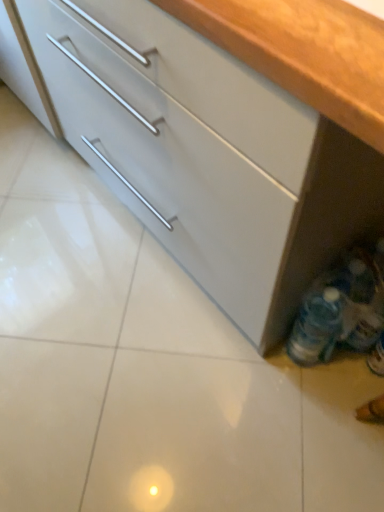
This screenshot has width=384, height=512. I want to click on free space that is to the left of translucent plastic bottles at lower right, so click(x=256, y=367).